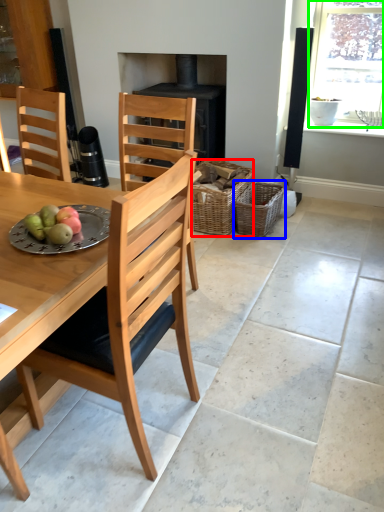
Question: Considering the real-world distances, which object is farthest from basket (highlighted by a red box)? basket (highlighted by a blue box) or window (highlighted by a green box)?

Choices:
 (A) basket
 (B) window

Answer: (B)